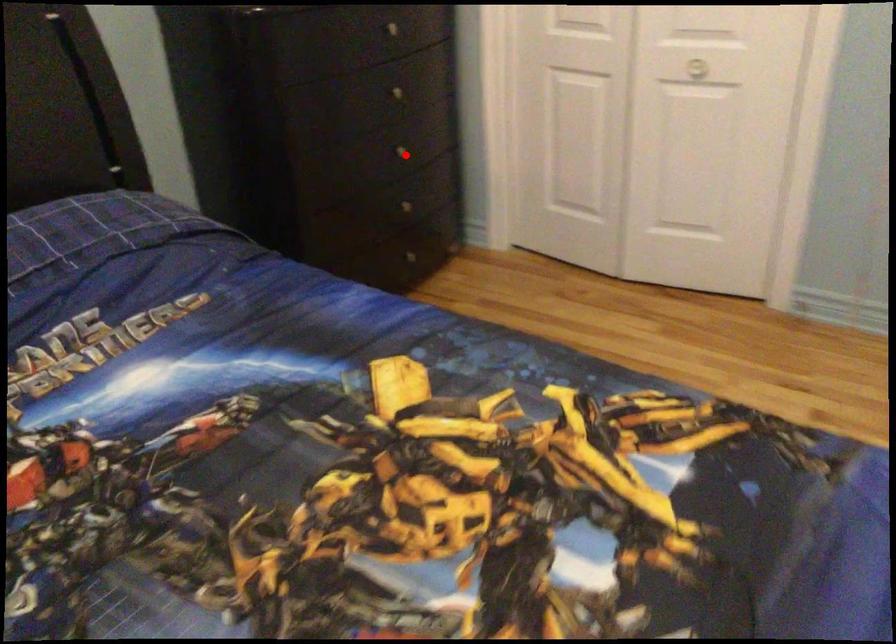
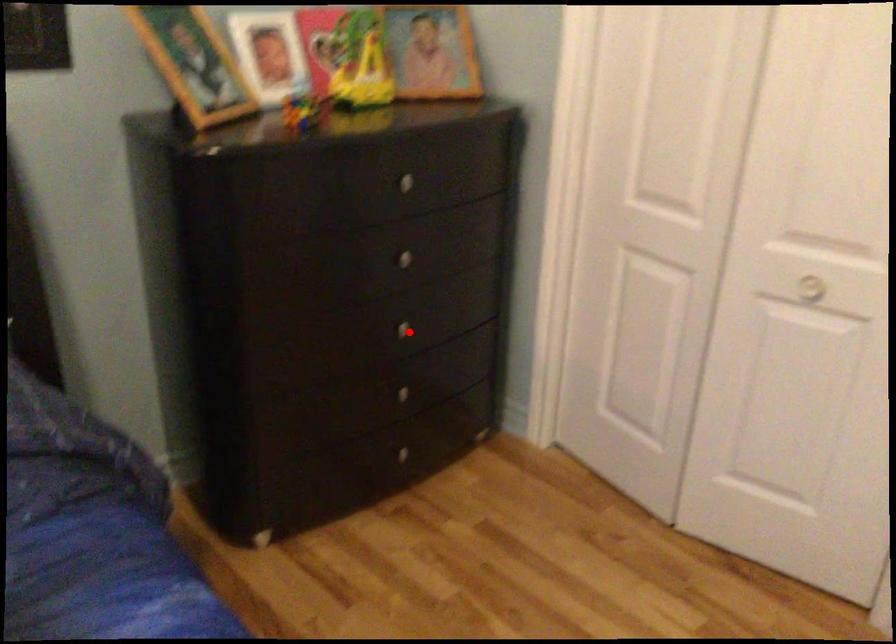
I am providing you with two images of the same scene from different viewpoints. A red point is marked on the first image and another point is marked on the second image. Does the point marked in image1 correspond to the same location as the one in image2?

Yes